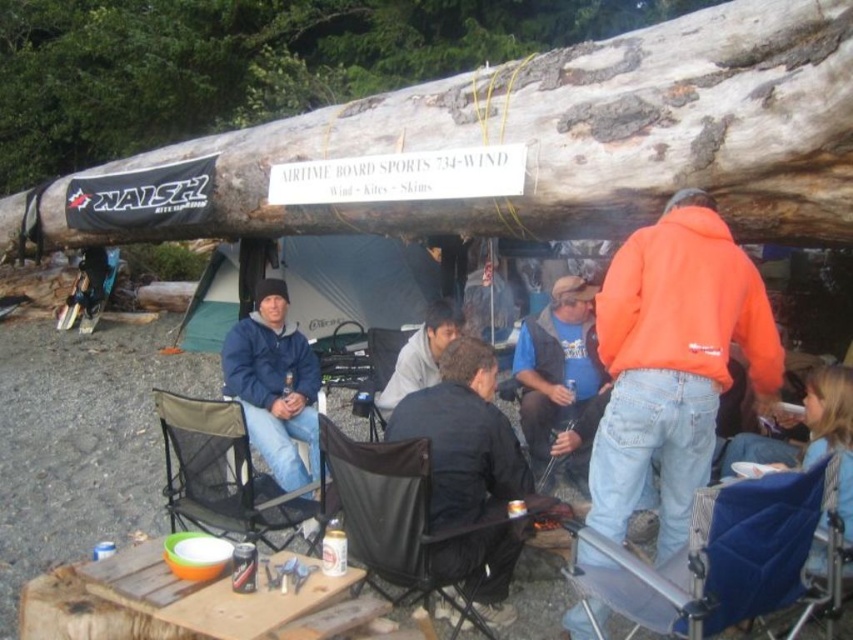
Is blue fleece jacket at center wider than light gray sweater at center?

Yes.

Find the location of `blue fleece jacket at center`. blue fleece jacket at center is located at coordinates (274, 385).

Which is behind, point (384, 252) or point (383, 500)?

Positioned behind is point (384, 252).

Can you confirm if green fabric tent at center is positioned to the left of black fabric chair at center?

Indeed, green fabric tent at center is positioned on the left side of black fabric chair at center.

Which is behind, point (277, 275) or point (402, 467)?

Point (277, 275)

You are a GUI agent. You are given a task and a screenshot of the screen. Output one action in this format:
    pyautogui.click(x=<x>, y=<y>)
    Task: Click on the green fabric tent at center
    The width and height of the screenshot is (853, 640).
    Given the screenshot: What is the action you would take?
    pyautogui.click(x=355, y=282)

Between natural wood log at upper center and green fabric tent at center, which one is positioned higher?

Positioned higher is natural wood log at upper center.

Does point (526, 26) come farther from viewer compared to point (213, 352)?

Yes, point (526, 26) is behind point (213, 352).

Which is behind, point (141, 136) or point (383, 305)?

Point (141, 136)

At what (x,y) coordinates should I click in order to perform the action: click on natural wood log at upper center. Please return your answer as a coordinate pair (x, y). The height and width of the screenshot is (640, 853). Looking at the image, I should click on (247, 61).